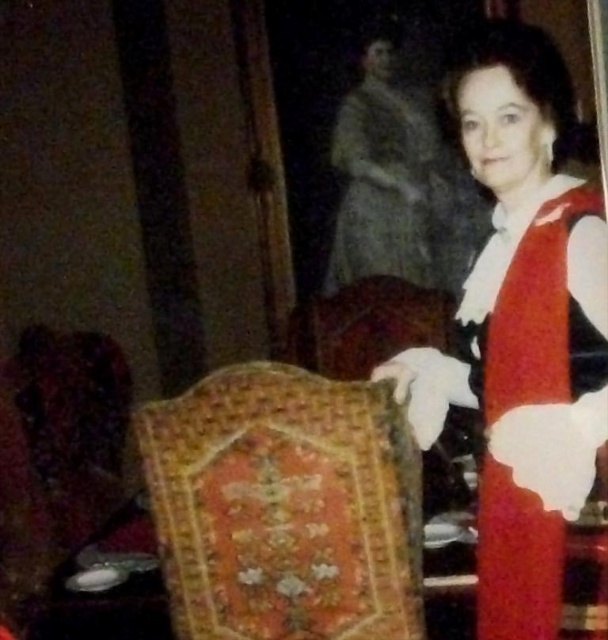
Question: Which point is closer to the camera taking this photo?

Choices:
 (A) (510, 548)
 (B) (323, 572)

Answer: (A)

Question: Which point appears farthest from the camera in this image?

Choices:
 (A) (410, 460)
 (B) (554, 349)

Answer: (A)

Question: Does matte red dress at right appear on the left side of embroidered velvet armchair at center?

Choices:
 (A) yes
 (B) no

Answer: (B)

Question: Is matte red dress at right positioned in front of embroidered velvet armchair at center?

Choices:
 (A) no
 (B) yes

Answer: (B)

Question: Does matte red dress at right have a smaller size compared to embroidered velvet armchair at center?

Choices:
 (A) no
 (B) yes

Answer: (A)